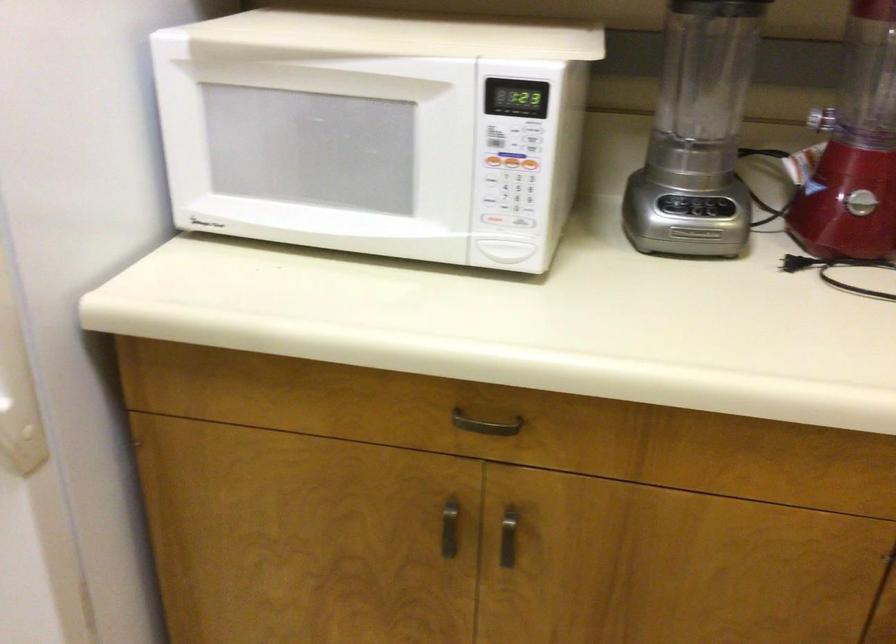
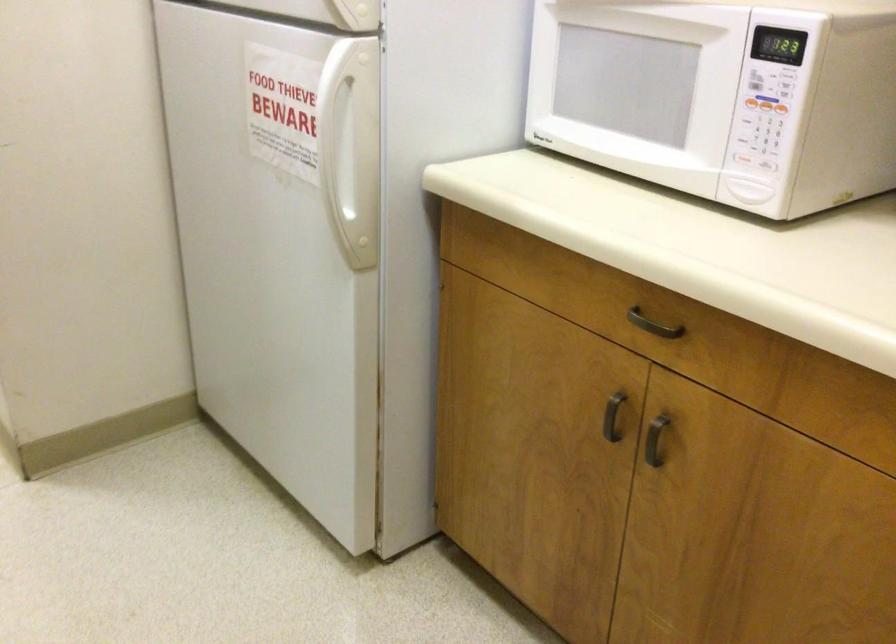
The point at (x=493, y=220) is marked in the first image. Where is the corresponding point in the second image?

(741, 158)